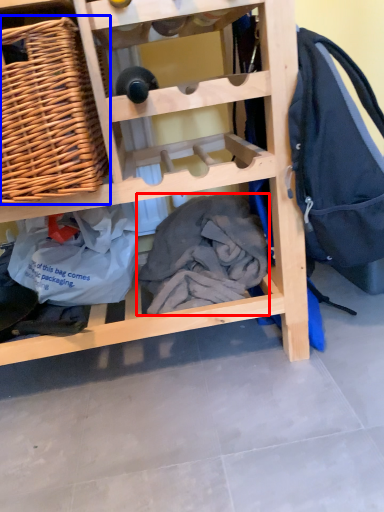
Question: Which point is closer to the camera, clothing (highlighted by a red box) or picnic basket (highlighted by a blue box)?

Choices:
 (A) clothing
 (B) picnic basket

Answer: (B)